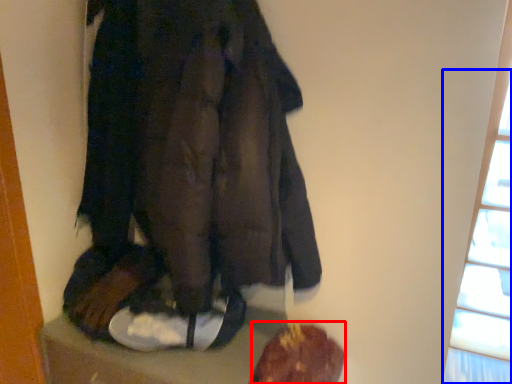
Question: Which of the following is the farthest to the observer, food (highlighted by a red box) or window (highlighted by a blue box)?

Choices:
 (A) food
 (B) window

Answer: (A)